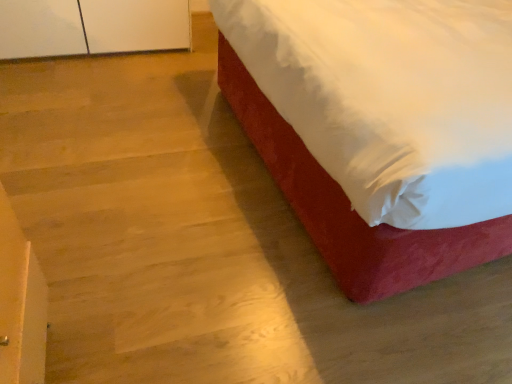
Locate an element on the screen. The height and width of the screenshot is (384, 512). velvet red bed at right is located at coordinates (380, 128).

The height and width of the screenshot is (384, 512). What do you see at coordinates (380, 128) in the screenshot?
I see `velvet red bed at right` at bounding box center [380, 128].

Find the location of a particular element. The height and width of the screenshot is (384, 512). velvet red bed at right is located at coordinates (380, 128).